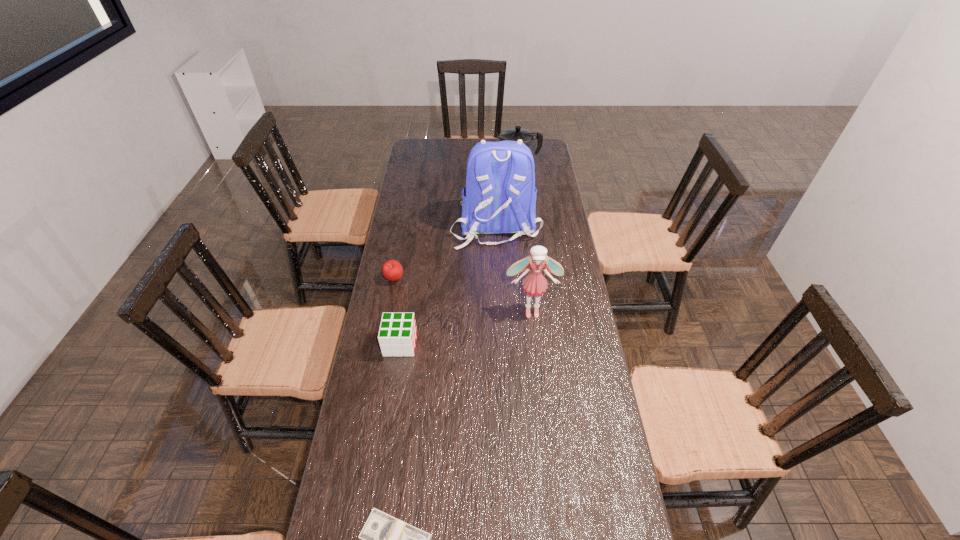
Where is `the tallest object`? Image resolution: width=960 pixels, height=540 pixels. the tallest object is located at coordinates (500, 196).

At what (x,y) coordinates should I click in order to perform the action: click on the fifth nearest object. Please return your answer as a coordinate pair (x, y). Looking at the image, I should click on (500, 196).

Where is `the third nearest object`? This screenshot has height=540, width=960. the third nearest object is located at coordinates (535, 284).

This screenshot has width=960, height=540. In order to click on the fifth shortest object in this screenshot , I will do `click(535, 284)`.

Image resolution: width=960 pixels, height=540 pixels. Identify the location of the farthest object. (515, 134).

At what (x,y) coordinates should I click in order to perform the action: click on the third tallest object. Please return your answer as a coordinate pair (x, y). The image size is (960, 540). Looking at the image, I should click on (515, 134).

Identify the location of cube. (397, 336).

The image size is (960, 540). Find the location of `the second nearest object`. the second nearest object is located at coordinates (397, 336).

You are a GUI agent. You are given a task and a screenshot of the screen. Output one action in this format:
    pyautogui.click(x=<x>, y=<y>)
    Task: Click on the third farthest object
    The height and width of the screenshot is (540, 960).
    Given the screenshot: What is the action you would take?
    pyautogui.click(x=392, y=270)

Identify the location of apple. (392, 270).